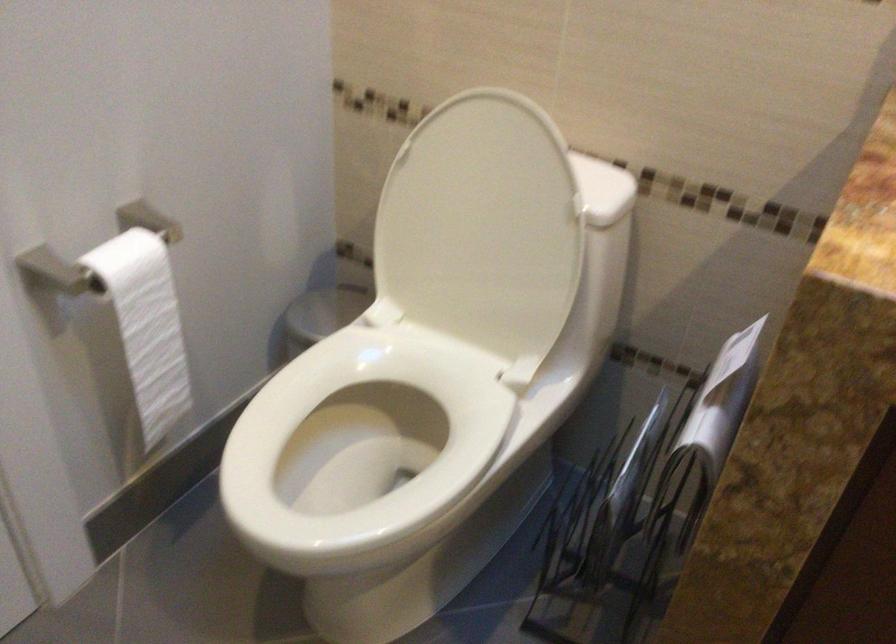
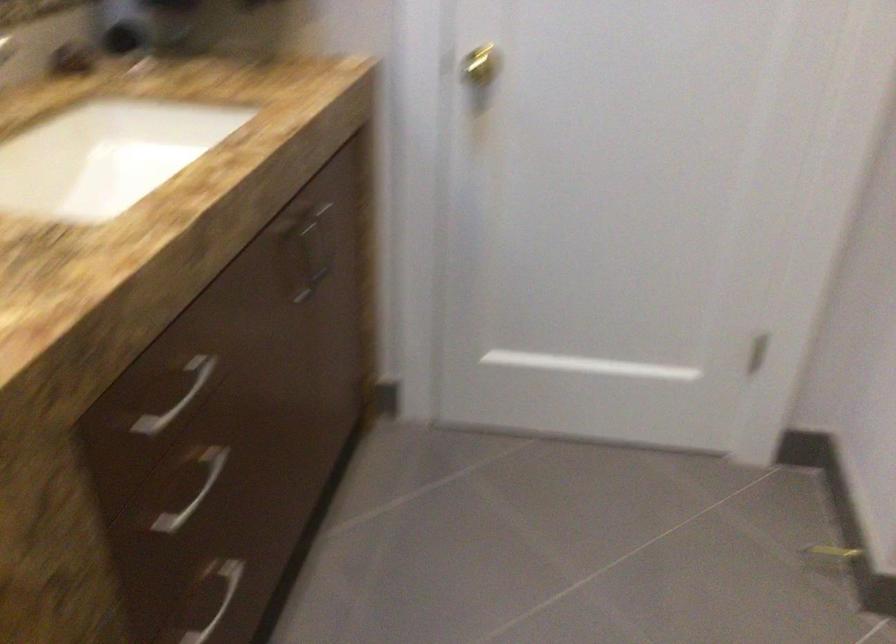
Based on the continuous images, in which direction is the camera rotating?

The camera's rotation is toward right-down.